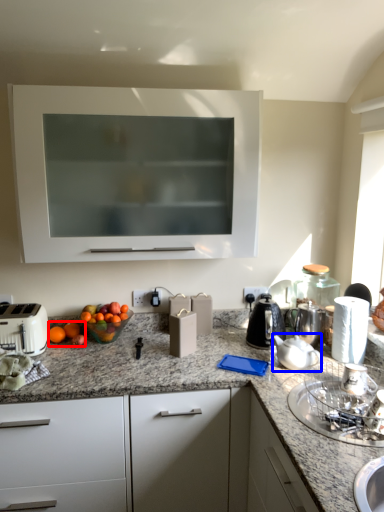
Question: Which point is closer to the camera, citrus fruit (highlighted by a red box) or tea pot (highlighted by a blue box)?

Choices:
 (A) citrus fruit
 (B) tea pot

Answer: (B)